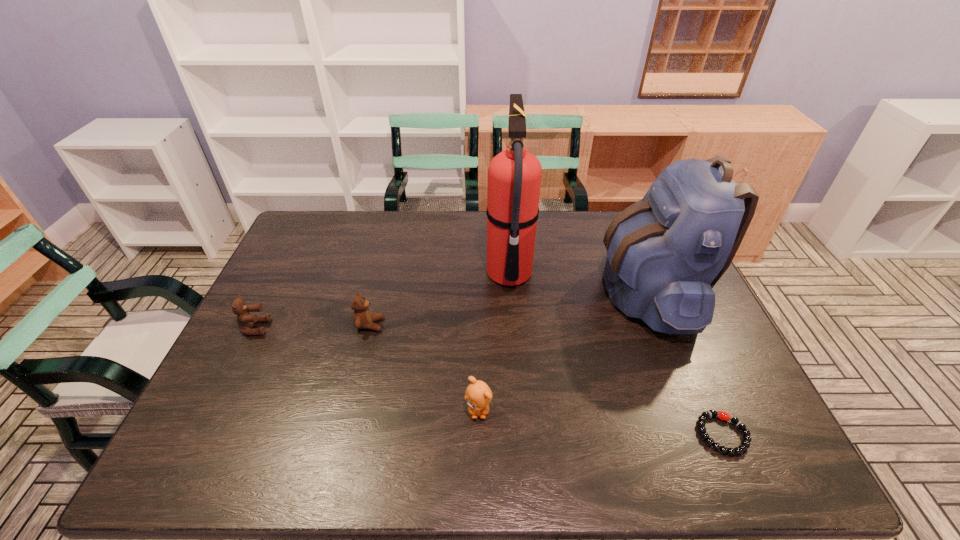
This screenshot has height=540, width=960. Find the location of `bracelet present at the right edge`. bracelet present at the right edge is located at coordinates (724, 416).

This screenshot has height=540, width=960. Identify the location of object that is at the far right corner. pos(665,253).

Where is `object that is at the near right corner`? object that is at the near right corner is located at coordinates (724, 416).

In the image, there is a desktop. Where is `vacant space at the far edge`? Image resolution: width=960 pixels, height=540 pixels. vacant space at the far edge is located at coordinates (351, 243).

In the image, there is a desktop. Where is `free space at the right edge`? The height and width of the screenshot is (540, 960). free space at the right edge is located at coordinates (670, 356).

Identify the location of free space at the near left corner of the desktop. (190, 457).

Find the location of a particular element. This screenshot has height=540, width=960. blank region between the tallest object and the second teddy bear from left to right is located at coordinates (440, 299).

Find the location of a particular element. The height and width of the screenshot is (540, 960). vacant point located between the rightmost teddy bear and the leftmost object is located at coordinates (367, 368).

This screenshot has height=540, width=960. In order to click on empty space between the tallest object and the leftmost object in this screenshot , I will do `click(382, 301)`.

Find the location of `free space between the leftmost object and the shortest object`. free space between the leftmost object and the shortest object is located at coordinates (490, 381).